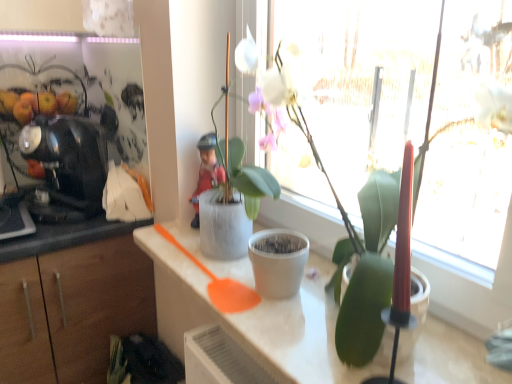
Locate an element on the screen. This screenshot has width=512, height=384. vacant space to the left of white matte pot at center, the first houseplant viewed from the back is located at coordinates (172, 244).